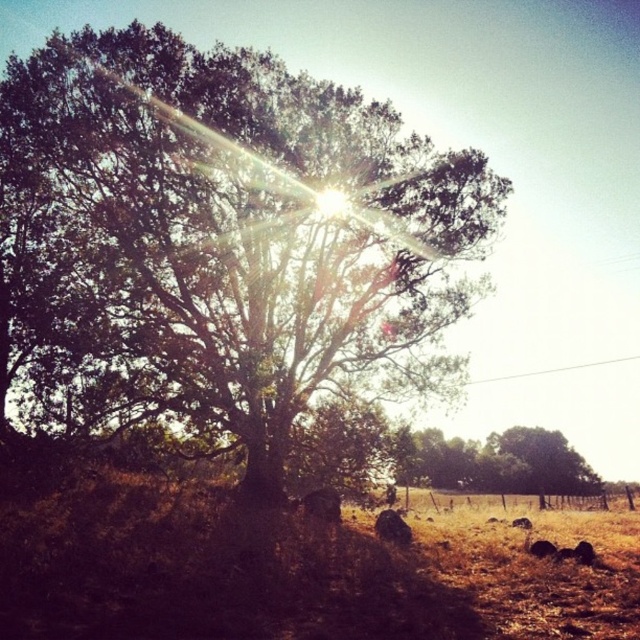
Which of these two, green leafy tree at center or green leafy tree at lower right, stands shorter?

green leafy tree at lower right is shorter.

Between green leafy tree at center and green leafy tree at lower right, which one appears on the right side from the viewer's perspective?

From the viewer's perspective, green leafy tree at lower right appears more on the right side.

Is point (316, 164) closer to viewer compared to point (508, 465)?

Yes, it is in front of point (508, 465).

You are a GUI agent. You are given a task and a screenshot of the screen. Output one action in this format:
    pyautogui.click(x=<x>, y=<y>)
    Task: Click on the green leafy tree at center
    The height and width of the screenshot is (640, 640).
    Given the screenshot: What is the action you would take?
    (234, 240)